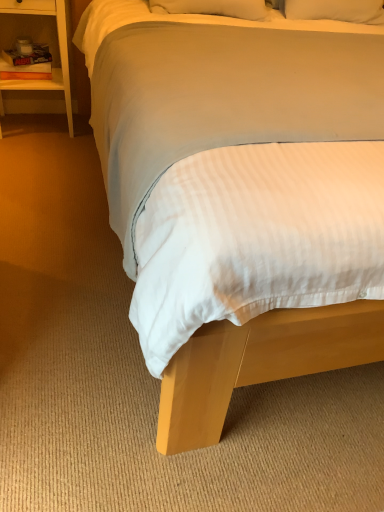
Question: From a real-world perspective, relative to white soft bed at center, is white wood nightstand at left vertically above or below?

Choices:
 (A) above
 (B) below

Answer: (B)

Question: In terms of height, does white wood nightstand at left look taller or shorter compared to white soft bed at center?

Choices:
 (A) tall
 (B) short

Answer: (B)

Question: From the image's perspective, is white wood nightstand at left above or below white soft bed at center?

Choices:
 (A) below
 (B) above

Answer: (B)

Question: Is white soft bed at center spatially inside white wood nightstand at left, or outside of it?

Choices:
 (A) outside
 (B) inside

Answer: (A)

Question: Is white soft bed at center taller or shorter than white wood nightstand at left?

Choices:
 (A) short
 (B) tall

Answer: (B)

Question: From the image's perspective, relative to white wood nightstand at left, is white soft bed at center above or below?

Choices:
 (A) above
 (B) below

Answer: (B)

Question: In the image, is white soft bed at center positioned in front of or behind white wood nightstand at left?

Choices:
 (A) behind
 (B) front

Answer: (B)